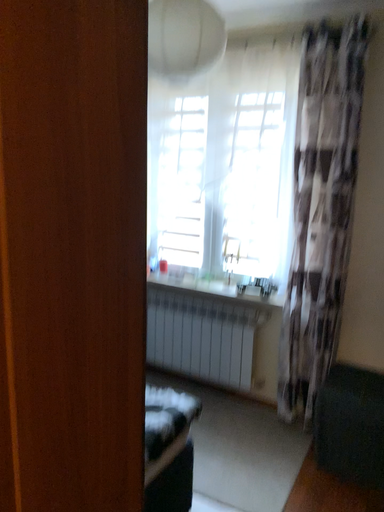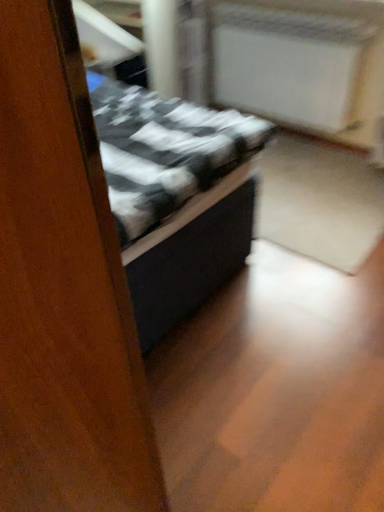
Question: Which way did the camera rotate in the video?

Choices:
 (A) rotated upward
 (B) rotated downward

Answer: (B)